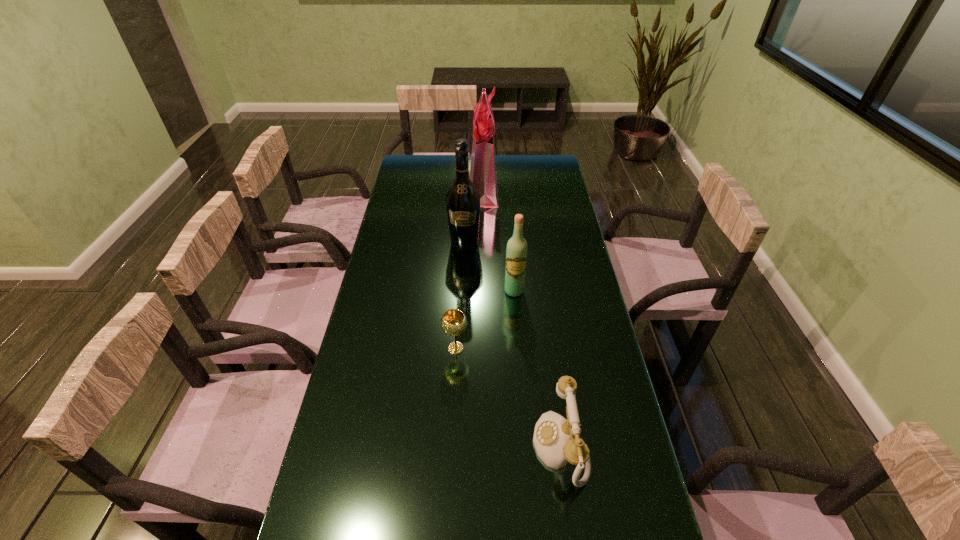
In order to click on the farthest object in this screenshot , I will do `click(482, 169)`.

Locate an element on the screen. Image resolution: width=960 pixels, height=540 pixels. the farther wine bottle is located at coordinates (463, 199).

Locate an element on the screen. the taller wine bottle is located at coordinates (463, 199).

You are a GUI agent. You are given a task and a screenshot of the screen. Output one action in this format:
    pyautogui.click(x=<x>, y=<y>)
    Task: Click on the right wine bottle
    
    Given the screenshot: What is the action you would take?
    (516, 252)

Locate an element on the screen. The image size is (960, 540). the third tallest object is located at coordinates (516, 252).

Where is `the nearest object`? the nearest object is located at coordinates (557, 441).

You are a GUI agent. You are given a task and a screenshot of the screen. Output one action in this format:
    pyautogui.click(x=<x>, y=<y>)
    Task: Click on the chalice
    The image size is (960, 540).
    Given the screenshot: What is the action you would take?
    pyautogui.click(x=454, y=322)

Locate an element on the screen. Image resolution: width=960 pixels, height=540 pixels. free location located 0.200m on the left of the shopping bag is located at coordinates (425, 188).

Identify the location of free point located on the label of the left wine bottle. Image resolution: width=960 pixels, height=540 pixels. (462, 316).

The width and height of the screenshot is (960, 540). What are the coordinates of `vacant space located on the front-facing side of the nearer wine bottle` in the screenshot? It's located at (517, 330).